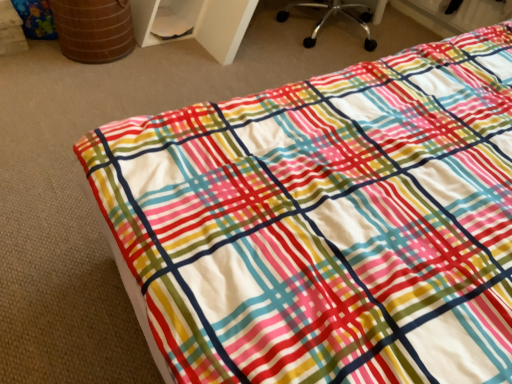
Find the location of a particular element. The image size is (512, 384). vacant area that is in front of metallic silver chair at upper center is located at coordinates (295, 64).